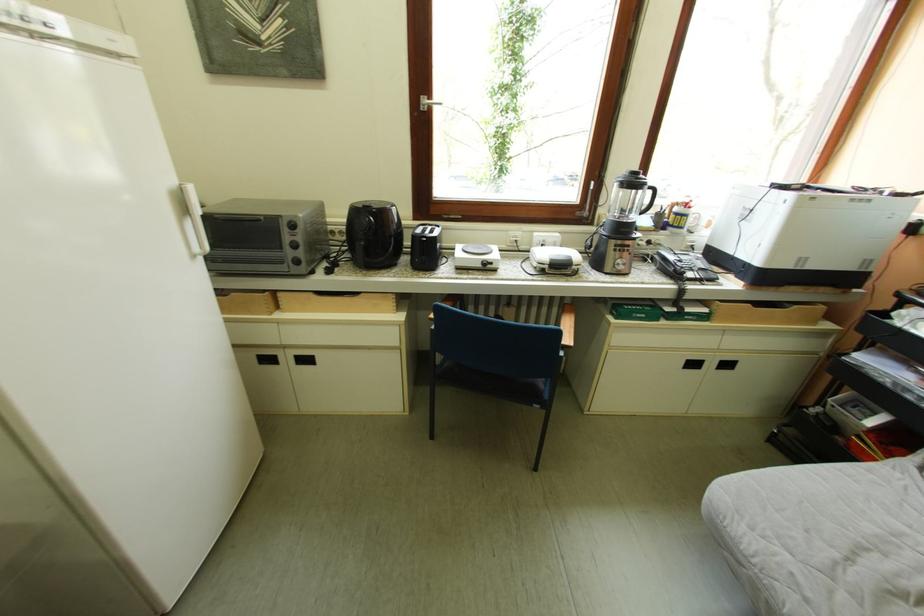
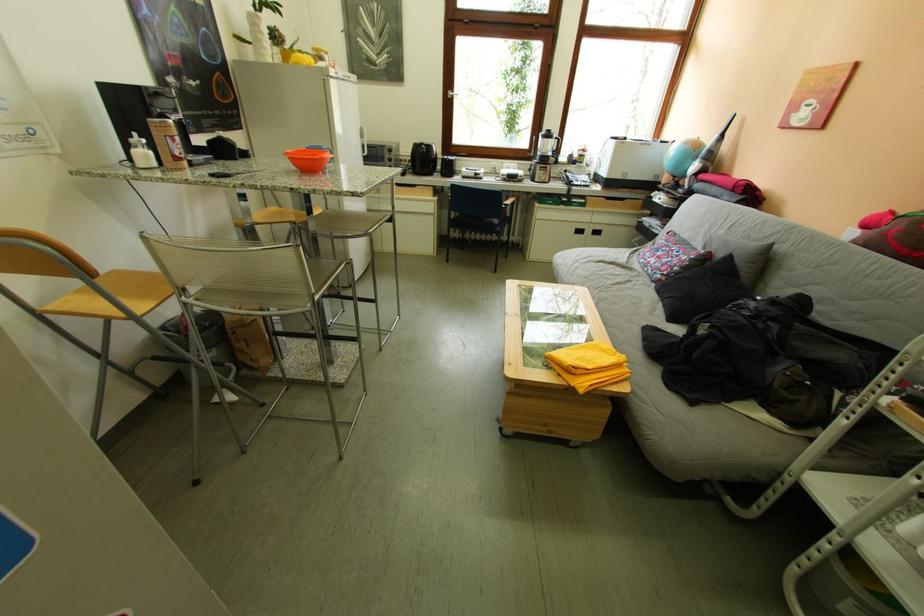
In the second image, find the point that corresponds to the point at 551,408 in the first image.

(507, 238)